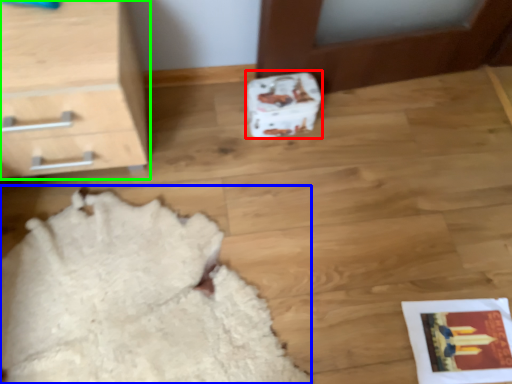
Question: Which object is positioned farthest from shoe box (highlighted by a red box)? Select from blanket (highlighted by a blue box) and chest of drawers (highlighted by a green box).

Choices:
 (A) blanket
 (B) chest of drawers

Answer: (A)